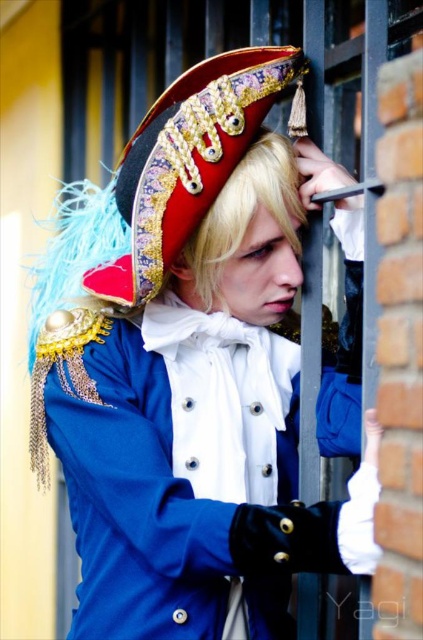
Question: Among these points, which one is farthest from the camera?

Choices:
 (A) (153, 211)
 (B) (269, 195)

Answer: (B)

Question: Is shiny gold and velvet hat at center to the left of blonde hair at center from the viewer's perspective?

Choices:
 (A) no
 (B) yes

Answer: (B)

Question: Does shiny gold and velvet hat at center have a smaller size compared to blonde hair at center?

Choices:
 (A) yes
 (B) no

Answer: (B)

Question: Is shiny gold and velvet hat at center positioned in front of blonde hair at center?

Choices:
 (A) no
 (B) yes

Answer: (B)